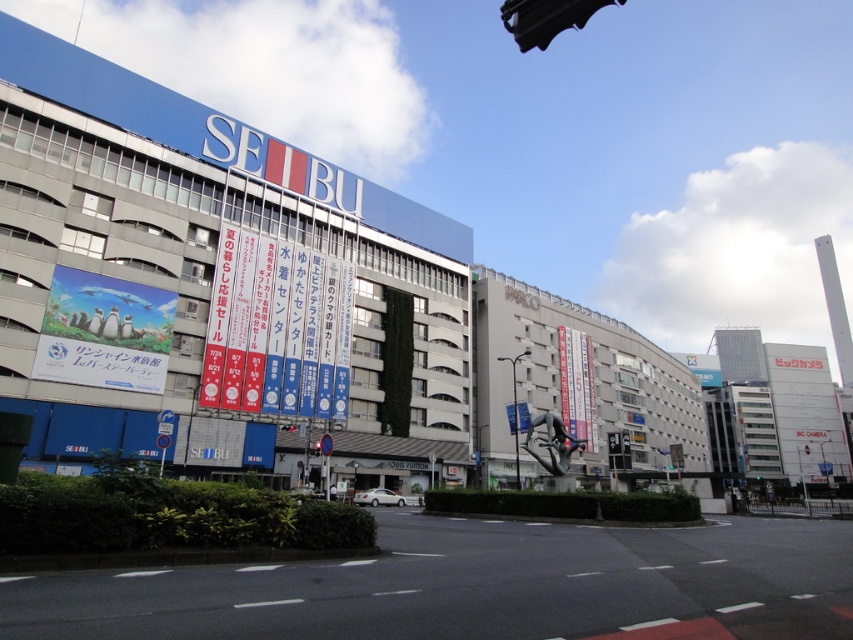
You are a pedestrian standing at the roundabout in front of the SEIBU building. You see the black plastic traffic light at upper center and the red glass traffic light at center. Which traffic light is positioned to the left of the other?

The black plastic traffic light at upper center is to the left of the red glass traffic light at center.

You are a delivery driver approaching the SEIBU building and need to turn left. There is a black plastic traffic light at upper center. Can you make a left turn at this traffic light?

The black plastic traffic light at upper center is located at point (286, 428), which is at the upper center position. Since traffic lights typically allow left turns if the arrow is green, but the description does not specify the traffic light status. However, based on the position, it is possible to make a left turn if the light allows.

You are a delivery person trying to navigate through the roundabout in front of the SEIBU building. You need to know which object, the white paper banners at center or the black plastic traffic light at upper center, is larger to determine the best path. Which one is bigger?

The white paper banners at center is bigger than the black plastic traffic light at upper center, so the white paper banners at center is the larger object.